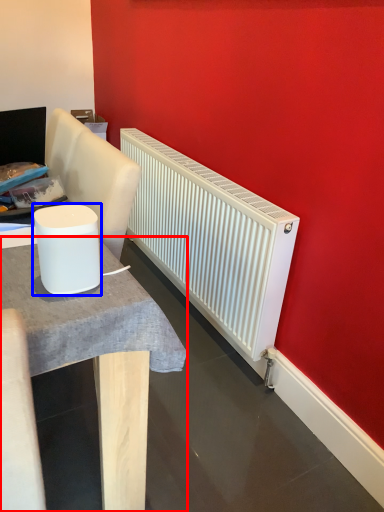
Question: Which object appears closest to the camera in this image, table (highlighted by a red box) or appliance (highlighted by a blue box)?

Choices:
 (A) table
 (B) appliance

Answer: (A)